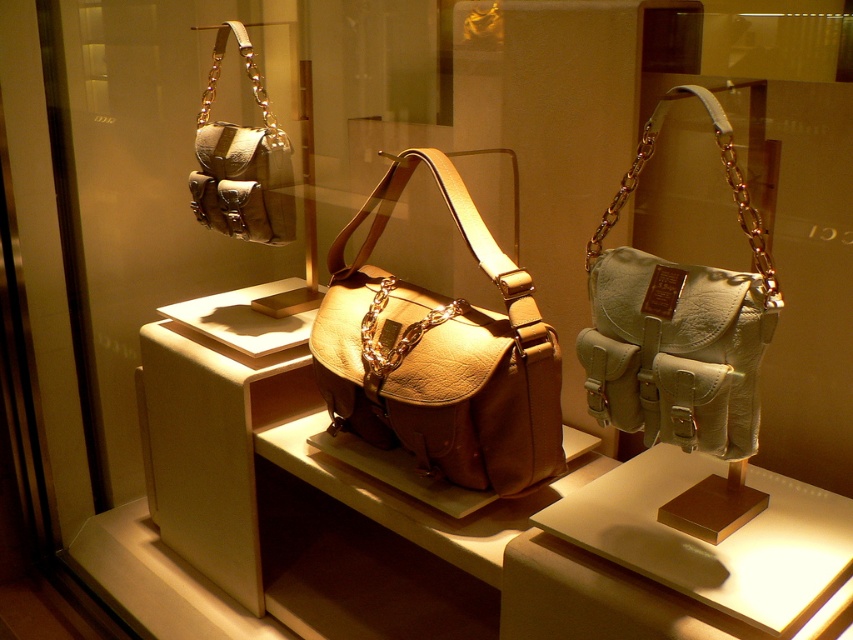
Question: Which object is the farthest from the matte brown leather handbag at upper left?

Choices:
 (A) light beige leather handbag at right
 (B) leather bag at center

Answer: (A)

Question: Is light beige leather handbag at right smaller than matte brown leather handbag at upper left?

Choices:
 (A) no
 (B) yes

Answer: (A)

Question: Which point appears farthest from the camera in this image?

Choices:
 (A) (376, 232)
 (B) (223, 204)
 (C) (717, 371)

Answer: (B)

Question: Does light beige leather handbag at right have a greater width compared to matte brown leather handbag at upper left?

Choices:
 (A) no
 (B) yes

Answer: (B)

Question: Is light beige leather handbag at right smaller than matte brown leather handbag at upper left?

Choices:
 (A) yes
 (B) no

Answer: (B)

Question: Which point is closer to the camera?

Choices:
 (A) light beige leather handbag at right
 (B) matte brown leather handbag at upper left

Answer: (A)